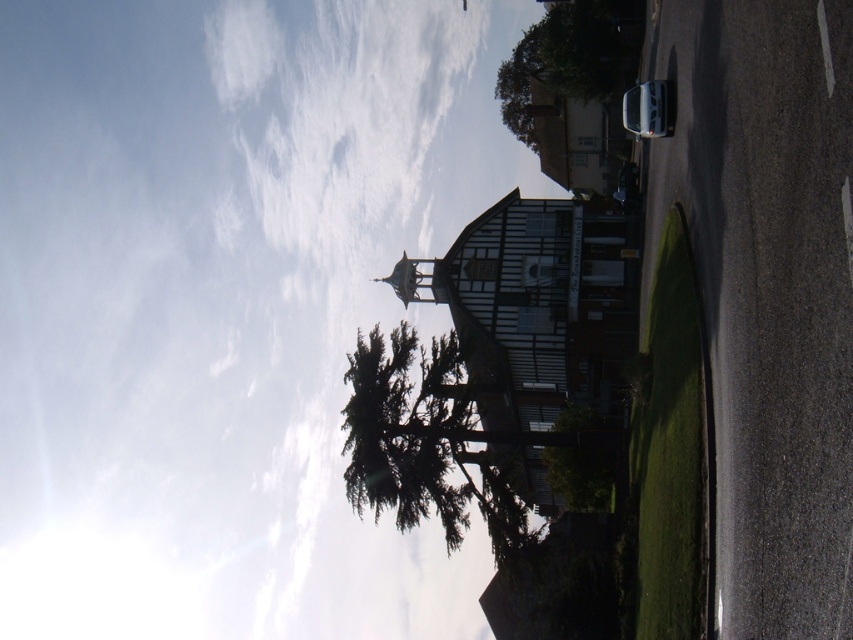
Question: Which point is farther to the camera?

Choices:
 (A) (167, 58)
 (B) (560, 454)
 (C) (361, 413)
 (D) (589, 74)

Answer: (A)

Question: Does green leafy tree at upper center lie in front of green leafy tree at center?

Choices:
 (A) no
 (B) yes

Answer: (A)

Question: Among these points, which one is farthest from the camera?

Choices:
 (A) (548, 452)
 (B) (553, 80)
 (C) (466, 520)
 (D) (515, 170)

Answer: (D)

Question: Is green textured tree at center to the right of green leafy tree at center from the viewer's perspective?

Choices:
 (A) no
 (B) yes

Answer: (A)

Question: Can you confirm if white fluffy cloud at upper center is bigger than green leafy tree at upper center?

Choices:
 (A) yes
 (B) no

Answer: (A)

Question: Among these objects, which one is farthest from the camera?

Choices:
 (A) green leafy tree at upper center
 (B) green textured tree at center
 (C) green leafy tree at center
 (D) white fluffy cloud at upper center

Answer: (A)